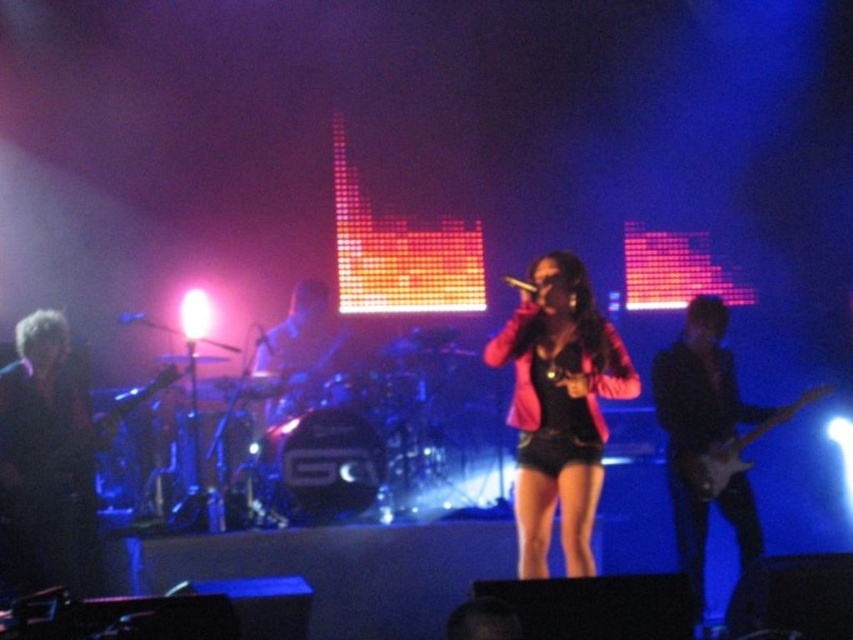
You are a sound technician at the concert venue and need to position a monitor speaker directly below the black matte microphone at center. What coordinates should the monitor speaker be placed at?

The monitor speaker should be placed at coordinates directly below the black matte microphone at center, which is at point 0.447 in the x and 0.614 in the y. Since the question specifies placing it directly below, the x coordinate remains the same, so the monitor speaker should be placed at approximately 0.447 in the x and a lower y coordinate than 0.614. However, without additional information on the exact distance or the coordinate system, the most precise answer is to maintain the same x coordinate and a

You are a stagehand who needs to adjust the lighting for the drummer. You see the glossy electric guitar at right and the metallic silver microphone at center. Which object is closer to the drummer?

The glossy electric guitar at right is in front of the metallic silver microphone at center, so it is closer to the drummer.